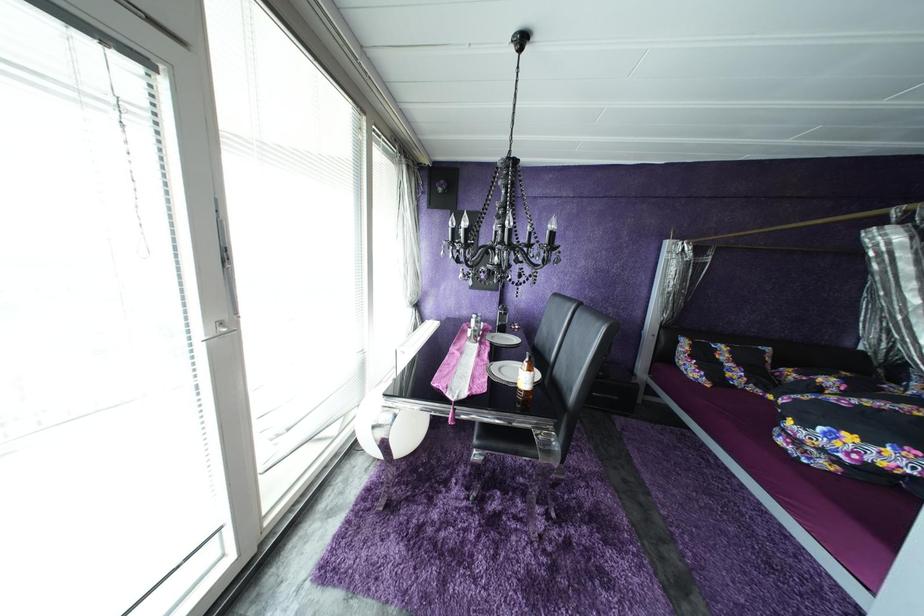
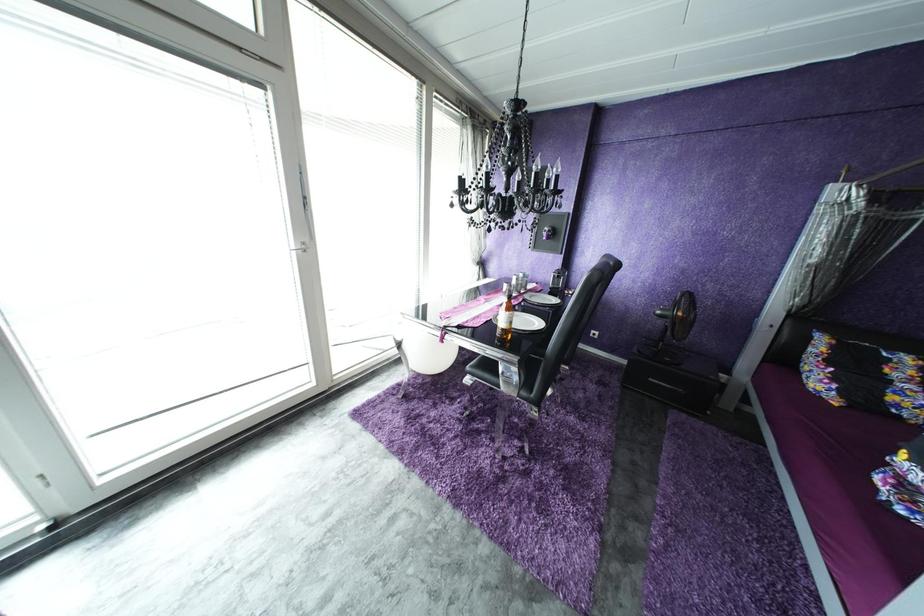
Question: The camera is either moving clockwise (left) or counter-clockwise (right) around the object. The first image is from the beginning of the video and the second image is from the end. Is the camera moving left or right when shooting the video?

Choices:
 (A) Left
 (B) Right

Answer: (B)